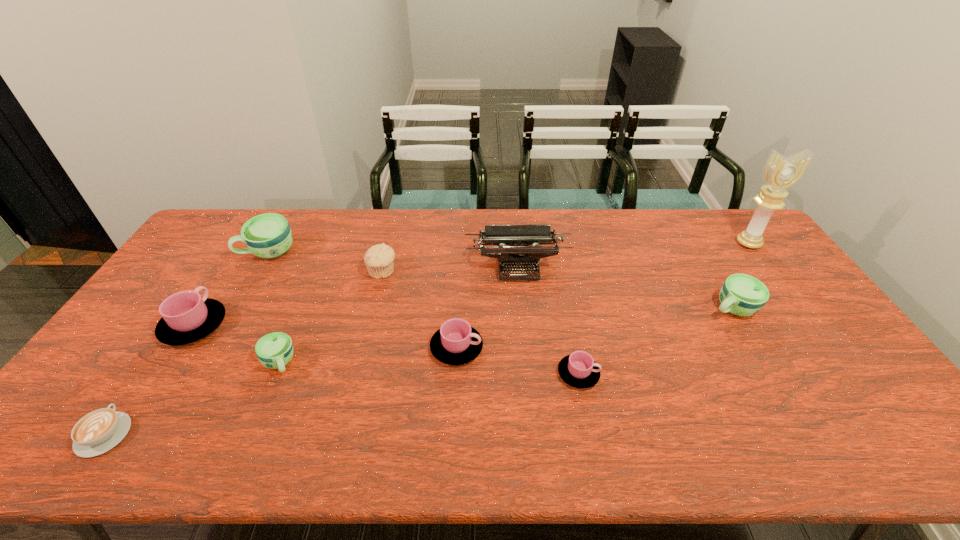
Image resolution: width=960 pixels, height=540 pixels. Find the location of `empty space between the farthest cup and the second blue cup from left to right`. empty space between the farthest cup and the second blue cup from left to right is located at coordinates tap(275, 308).

Identify the location of vacant space that's between the rightmost pink cup and the typewriter. (548, 320).

In order to click on vacant space that is in between the nearest blue cup and the typewriter in this screenshot , I will do [398, 315].

At what (x,y) coordinates should I click in order to perform the action: click on vacant space that is in between the biggest pink cup and the shortest object. Please return your answer as a coordinate pair (x, y). Looking at the image, I should click on (150, 380).

At what (x,y) coordinates should I click in order to perform the action: click on vacant point located between the biggest pink cup and the farthest blue cup. Please return your answer as a coordinate pair (x, y). Looking at the image, I should click on (231, 289).

This screenshot has width=960, height=540. Identify the location of vacant area that lies between the rightmost object and the leftmost pink cup. (471, 285).

Image resolution: width=960 pixels, height=540 pixels. I want to click on object that ranks as the second closest to the shortest cup, so click(x=519, y=238).

Choose which object is the ninth nearest neighbor to the fourth object from left to right. Please provide its 2D coordinates. Your answer should be formatted as a tuple, i.e. [(x, y)], where the tuple contains the x and y coordinates of a point satisfying the conditions above.

[(780, 174)]

Identify the location of cup that can be found as the second closest to the typewriter. The width and height of the screenshot is (960, 540). (579, 370).

Where is `cup object that ranks as the third closest to the second object from right to left`? cup object that ranks as the third closest to the second object from right to left is located at coordinates (275, 350).